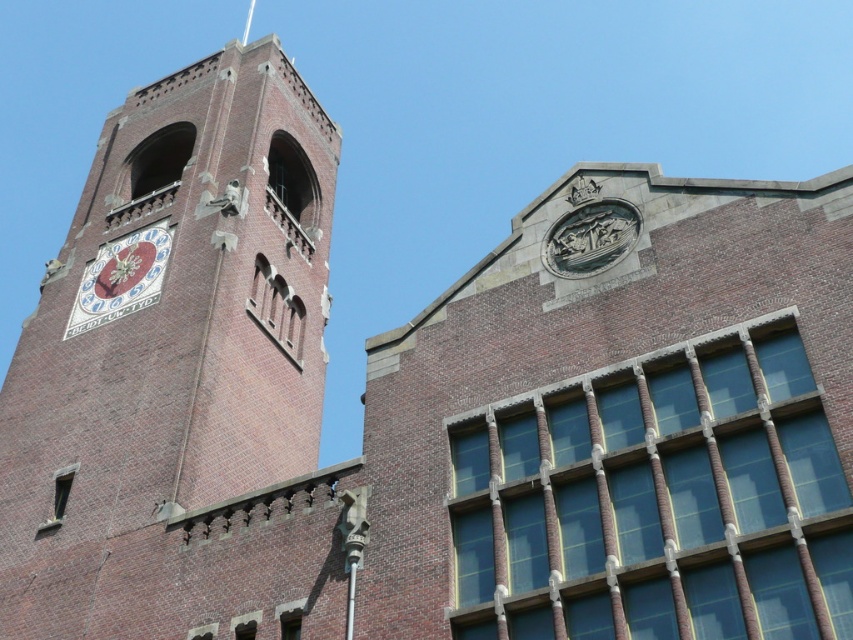
Question: Is brick clock tower at left bigger than matte white clock at upper left?

Choices:
 (A) yes
 (B) no

Answer: (A)

Question: Can you confirm if brick clock tower at left is smaller than matte white clock at upper left?

Choices:
 (A) no
 (B) yes

Answer: (A)

Question: Is brick clock tower at left below matte white clock at upper left?

Choices:
 (A) no
 (B) yes

Answer: (B)

Question: Which point is closer to the camera?

Choices:
 (A) (61, 353)
 (B) (157, 264)

Answer: (A)

Question: Which point appears closest to the camera in this image?

Choices:
 (A) (171, 237)
 (B) (207, 628)

Answer: (B)

Question: Among these points, which one is nearest to the camera?

Choices:
 (A) (114, 310)
 (B) (138, 352)

Answer: (B)